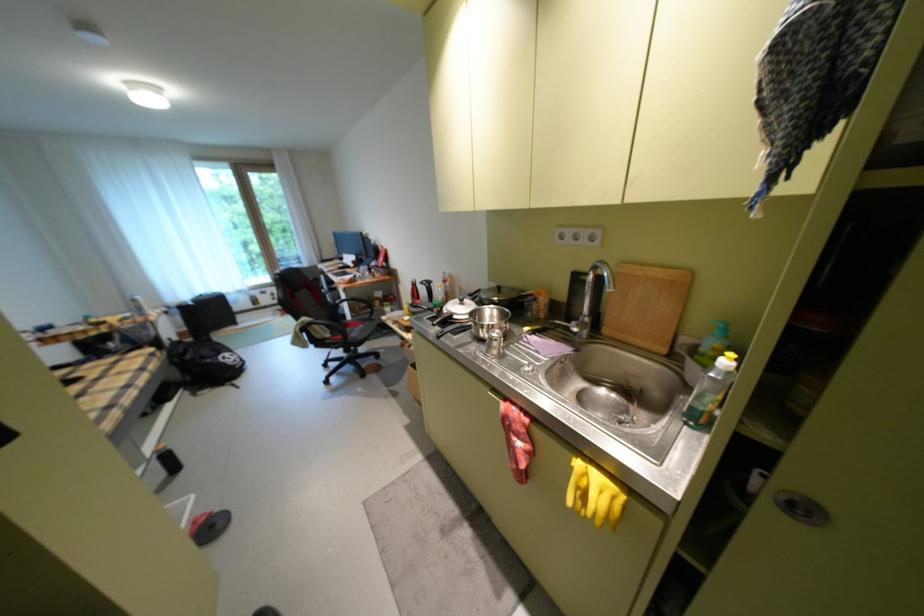
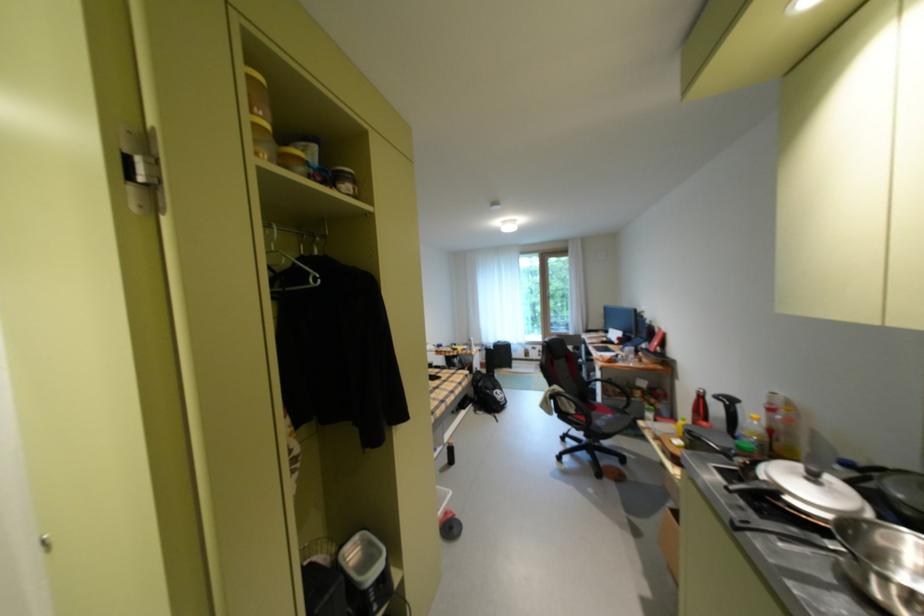
Where in the second image is the point corresponding to the point at 420,286 from the first image?

(704, 398)